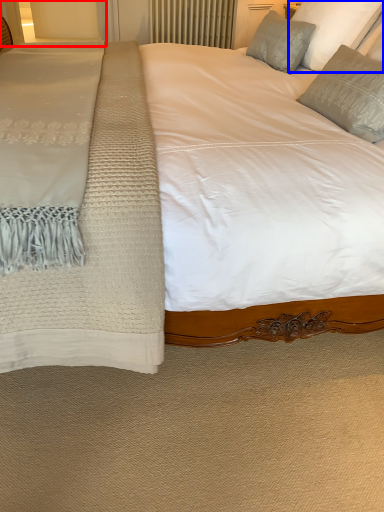
Question: Which point is further to the camera, glass door (highlighted by a red box) or pillow (highlighted by a blue box)?

Choices:
 (A) glass door
 (B) pillow

Answer: (A)